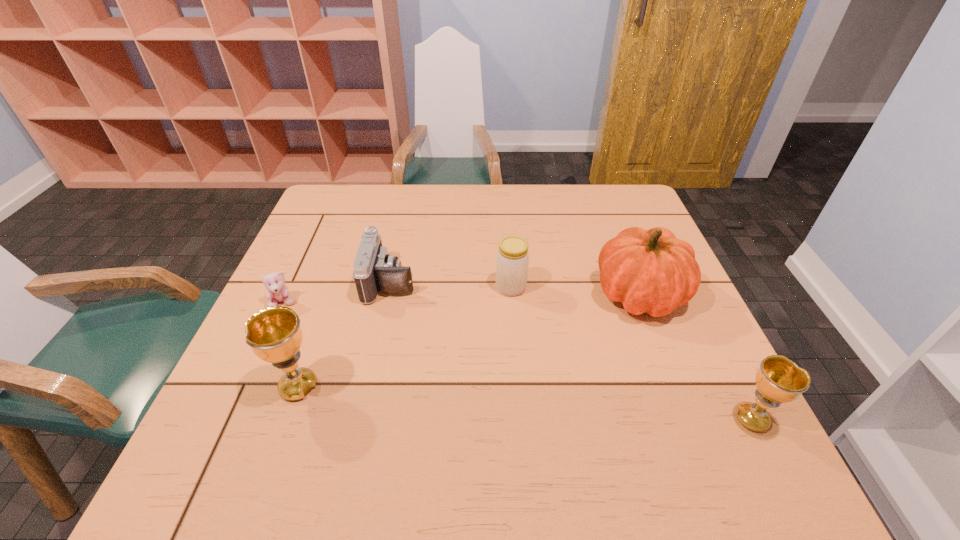
Find the location of `vacant space situated on the left of the shorter chalice`. vacant space situated on the left of the shorter chalice is located at coordinates (674, 419).

Find the location of a particular element. This screenshot has width=960, height=540. vacant space located 0.340m at the front of the camera with an open lens cover is located at coordinates (548, 281).

At what (x,y) coordinates should I click in order to perform the action: click on free space located 0.160m on the front of the pumpkin. Please return your answer as a coordinate pair (x, y). The width and height of the screenshot is (960, 540). Looking at the image, I should click on (676, 389).

You are a GUI agent. You are given a task and a screenshot of the screen. Output one action in this format:
    pyautogui.click(x=<x>, y=<y>)
    Task: Click on the free point located 0.260m on the left of the fourth object from left to right
    Image resolution: width=960 pixels, height=540 pixels.
    Given the screenshot: What is the action you would take?
    pyautogui.click(x=393, y=287)

In order to click on vacant space located 0.310m at the face of the shortest object in this screenshot , I will do `click(225, 431)`.

Identify the location of chalice that is at the left edge. (274, 334).

Locate an element on the screen. teddy bear present at the left edge is located at coordinates (277, 291).

At what (x,y) coordinates should I click in order to perform the action: click on chalice located in the right edge section of the desktop. Please return your answer as a coordinate pair (x, y). The image size is (960, 540). Looking at the image, I should click on (779, 380).

Find the location of a particular element. The height and width of the screenshot is (540, 960). pumpkin at the right edge is located at coordinates (652, 271).

The height and width of the screenshot is (540, 960). I want to click on object at the near left corner, so click(x=274, y=334).